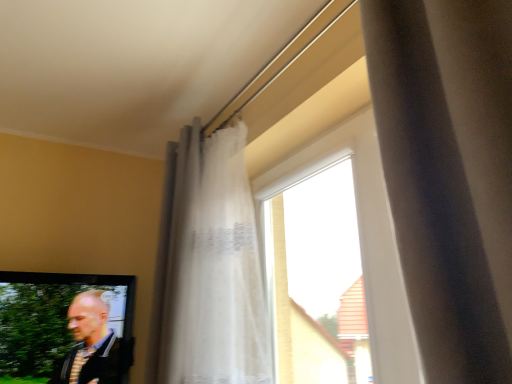
Image resolution: width=512 pixels, height=384 pixels. I want to click on transparent glass window at center, so click(x=364, y=239).

In the scene shown: Who is bigger, white sheer curtain at upper center or transparent glass window at center?

white sheer curtain at upper center.

How distant is white sheer curtain at upper center from transparent glass window at center?

They are 39.66 centimeters apart.

Would you consider white sheer curtain at upper center to be distant from transparent glass window at center?

No.

Which is closer to the camera, (x=251, y=196) or (x=378, y=196)?

Point (x=251, y=196).

Does white sheer curtain at upper center come in front of striped fabric shirt at lower left?

Yes.

Considering the points (184, 209) and (103, 373), which point is behind, point (184, 209) or point (103, 373)?

The point (103, 373) is farther from the camera.

Between white sheer curtain at upper center and striped fabric shirt at lower left, which one has smaller size?

striped fabric shirt at lower left is smaller.

From a real-world perspective, between white sheer curtain at upper center and striped fabric shirt at lower left, who is vertically lower?

striped fabric shirt at lower left.

Does transparent glass window at center have a greater height compared to striped fabric shirt at lower left?

Yes, transparent glass window at center is taller than striped fabric shirt at lower left.

Which is more to the right, transparent glass window at center or striped fabric shirt at lower left?

Positioned to the right is transparent glass window at center.

From the image's perspective, relative to striped fabric shirt at lower left, is transparent glass window at center above or below?

transparent glass window at center is situated higher than striped fabric shirt at lower left in the image.

Is transparent glass window at center positioned before striped fabric shirt at lower left?

Yes.

How many degrees apart are the facing directions of striped fabric shirt at lower left and white sheer curtain at upper center?

They differ by 94.1 degrees in their facing directions.

Where is `curtain located above the striped fabric shirt at lower left (from the image's perspective)`? The width and height of the screenshot is (512, 384). curtain located above the striped fabric shirt at lower left (from the image's perspective) is located at coordinates (209, 266).

Considering the relative positions of striped fabric shirt at lower left and white sheer curtain at upper center in the image provided, is striped fabric shirt at lower left behind white sheer curtain at upper center?

Yes, striped fabric shirt at lower left is behind white sheer curtain at upper center.

Between striped fabric shirt at lower left and white sheer curtain at upper center, which one has larger width?

white sheer curtain at upper center.

From the image's perspective, is transparent glass window at center over white sheer curtain at upper center?

Actually, transparent glass window at center appears below white sheer curtain at upper center in the image.

Consider the image. Considering the relative positions of transparent glass window at center and white sheer curtain at upper center in the image provided, is transparent glass window at center to the left of white sheer curtain at upper center from the viewer's perspective?

Incorrect, transparent glass window at center is not on the left side of white sheer curtain at upper center.

Which is in front, point (420, 366) or point (216, 357)?

The point (420, 366) is closer to the camera.

Is transparent glass window at center surrounding white sheer curtain at upper center?

No, white sheer curtain at upper center is not inside transparent glass window at center.

Would you say striped fabric shirt at lower left is inside or outside transparent glass window at center?

striped fabric shirt at lower left is not enclosed by transparent glass window at center.

From the picture: Can you tell me how much striped fabric shirt at lower left and transparent glass window at center differ in facing direction?

They differ by 91.4 degrees in their facing directions.

Which object is more forward, striped fabric shirt at lower left or transparent glass window at center?

transparent glass window at center is closer to the camera.

Considering the relative sizes of striped fabric shirt at lower left and transparent glass window at center in the image provided, is striped fabric shirt at lower left taller than transparent glass window at center?

No.

Where is `window in front of the white sheer curtain at upper center`? window in front of the white sheer curtain at upper center is located at coordinates (364, 239).

Identify the location of man lying below the white sheer curtain at upper center (from the image's perspective). (93, 345).

Estimate the real-world distances between objects in this image. Which object is further from striped fabric shirt at lower left, transparent glass window at center or white sheer curtain at upper center?

The object further to striped fabric shirt at lower left is transparent glass window at center.

Considering their positions, is white sheer curtain at upper center positioned closer to transparent glass window at center than striped fabric shirt at lower left?

white sheer curtain at upper center.

Considering their positions, is striped fabric shirt at lower left positioned closer to white sheer curtain at upper center than transparent glass window at center?

The object closer to white sheer curtain at upper center is transparent glass window at center.

Looking at the image, which one is located further to transparent glass window at center, striped fabric shirt at lower left or white sheer curtain at upper center?

striped fabric shirt at lower left lies further to transparent glass window at center than the other object.

Which object lies nearer to the anchor point striped fabric shirt at lower left, white sheer curtain at upper center or transparent glass window at center?

Among the two, white sheer curtain at upper center is located nearer to striped fabric shirt at lower left.

From the image, which object appears to be nearer to white sheer curtain at upper center, transparent glass window at center or striped fabric shirt at lower left?

Among the two, transparent glass window at center is located nearer to white sheer curtain at upper center.

You are a GUI agent. You are given a task and a screenshot of the screen. Output one action in this format:
    pyautogui.click(x=<x>, y=<y>)
    Task: Click on the curtain situated between striped fabric shirt at lower left and transparent glass window at center from left to right
    
    Given the screenshot: What is the action you would take?
    209,266